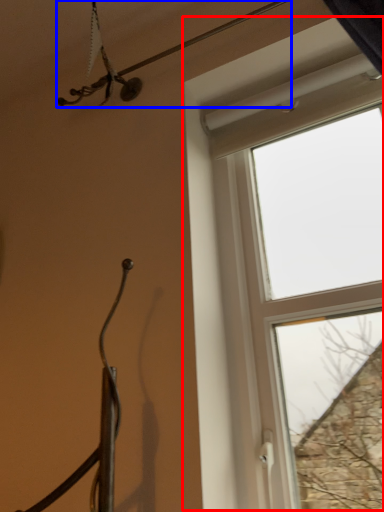
Question: Which of the following is the closest to the observer, window (highlighted by a red box) or wire (highlighted by a blue box)?

Choices:
 (A) window
 (B) wire

Answer: (A)